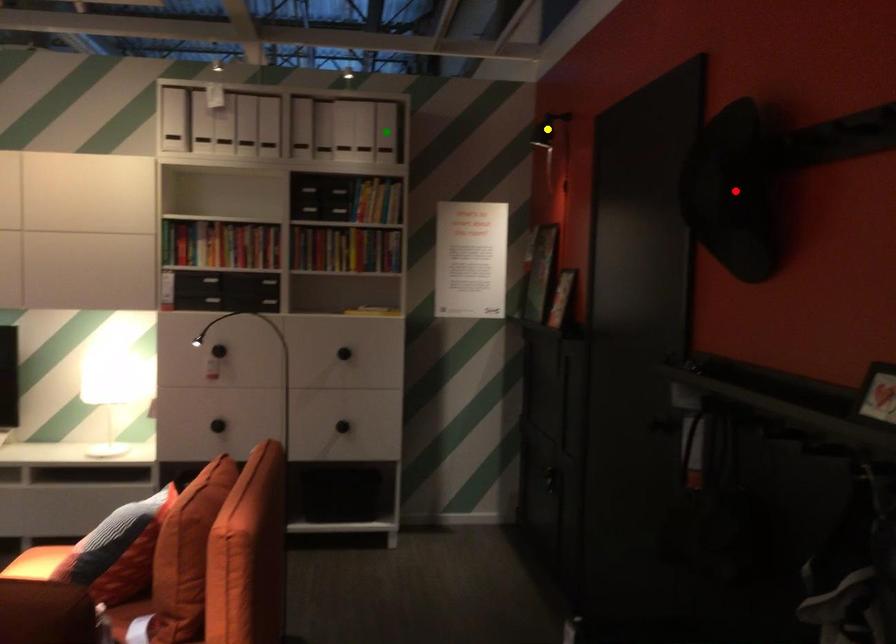
Order these from nearest to farthest:
1. red point
2. yellow point
3. green point

yellow point < green point < red point